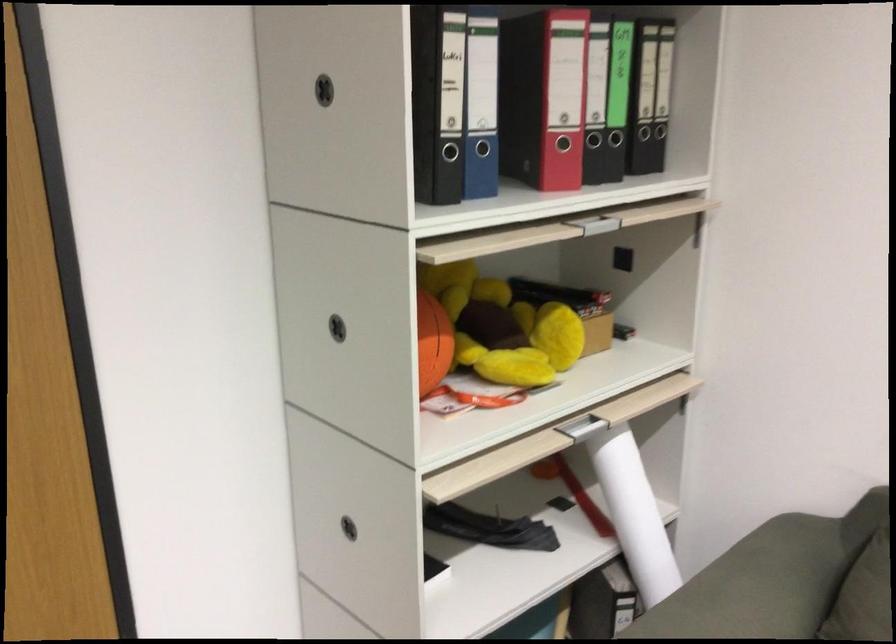
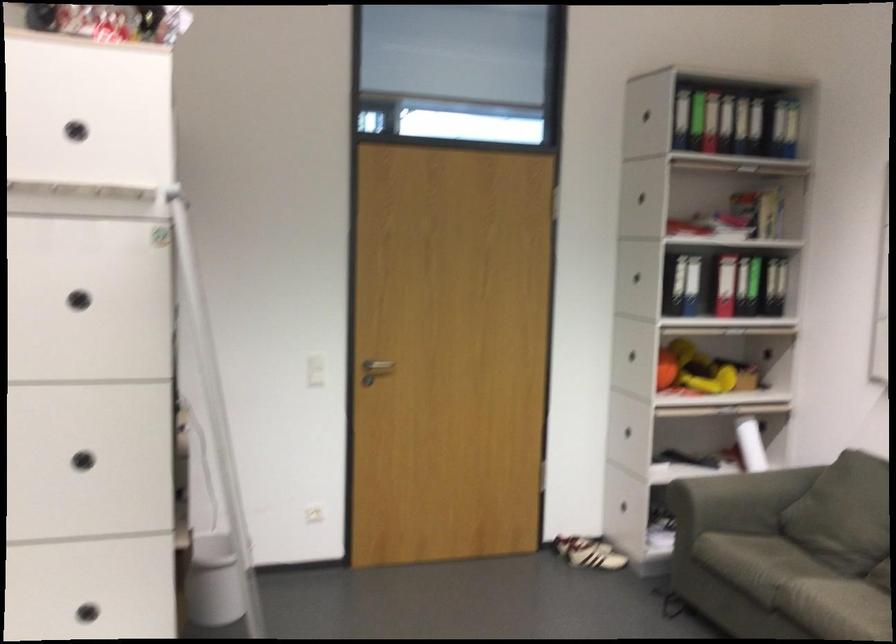
Question: What movement of the cameraman would produce the second image?

Choices:
 (A) Left
 (B) Right
 (C) Forward
 (D) Backward

Answer: (D)